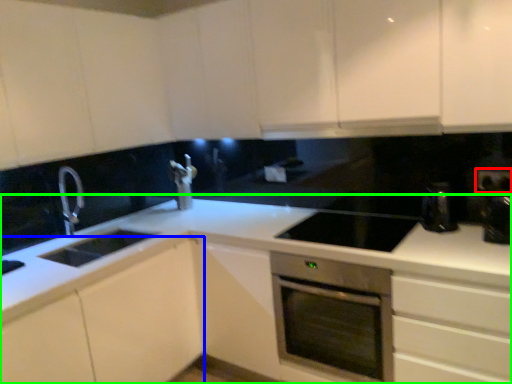
Question: Which object is positioned farthest from electric outlet (highlighted by a red box)? Select from cabinetry (highlighted by a blue box) and countertop (highlighted by a green box).

Choices:
 (A) cabinetry
 (B) countertop

Answer: (A)